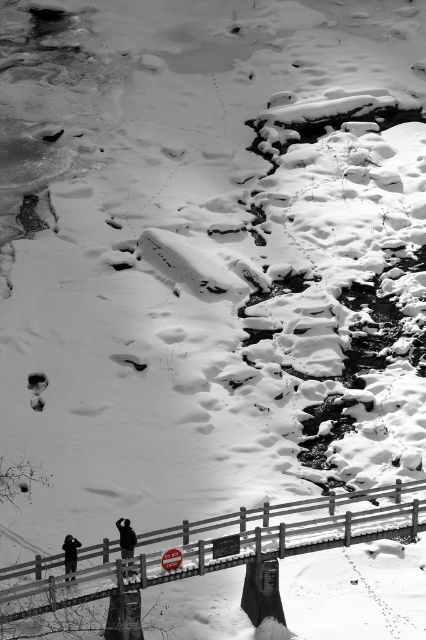
You are a hiker trying to cross the concrete bridge at center. There is a black matte jacket at center on the bridge. Which object is closer to you as you approach the bridge?

The concrete bridge at center is in front of the black matte jacket at center, so the concrete bridge at center is closer to you as you approach the bridge.

You are a hiker trying to locate your friend who is wearing a black matte jacket at center. You are currently standing at the black matte person at lower left. In which direction should you move to find your friend?

The black matte jacket at center is to the right of the black matte person at lower left, so you should move to the right to find your friend.

Looking at this image, you are a delivery robot with a 1.2 meter wide package. You need to cross the concrete bridge at center while avoiding the black matte person at lower left. Can you safely pass by them on the bridge?

The concrete bridge at center and black matte person at lower left are 3.99 meters apart from each other. Since the distance between them is greater than the robot and package combined width, the robot can safely pass by the black matte person at lower left on the concrete bridge at center.